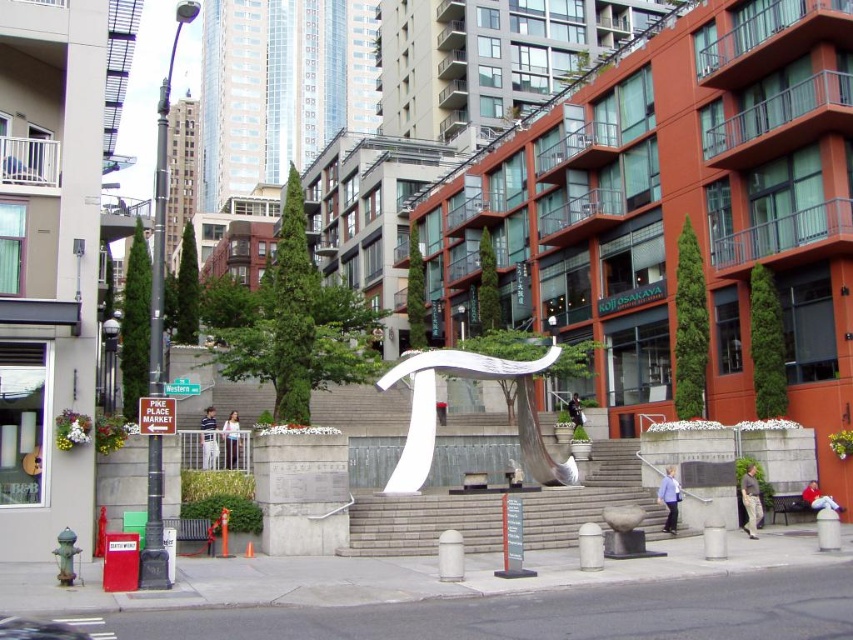
Between gray concrete stairs at center and white polished metal pi symbol at center, which one is positioned lower?

gray concrete stairs at center is below.

Can you confirm if gray concrete stairs at center is positioned below white polished metal pi symbol at center?

Correct, gray concrete stairs at center is located below white polished metal pi symbol at center.

Find the location of a particular element. This screenshot has height=640, width=853. gray concrete stairs at center is located at coordinates (500, 509).

At what (x,y) coordinates should I click in order to perform the action: click on gray concrete stairs at center. Please return your answer as a coordinate pair (x, y). Image resolution: width=853 pixels, height=640 pixels. Looking at the image, I should click on (500, 509).